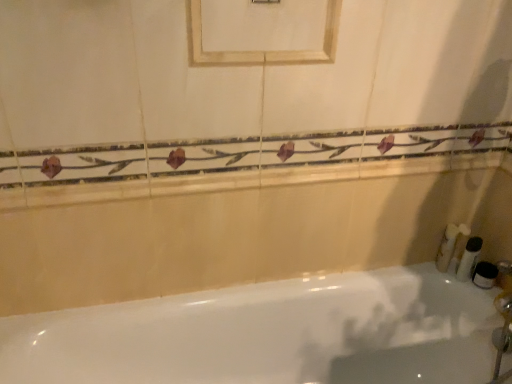
The height and width of the screenshot is (384, 512). In order to click on vacant space positioned to the left of white matte jar at right, the fourth toiletry from the left in this screenshot , I will do `click(433, 276)`.